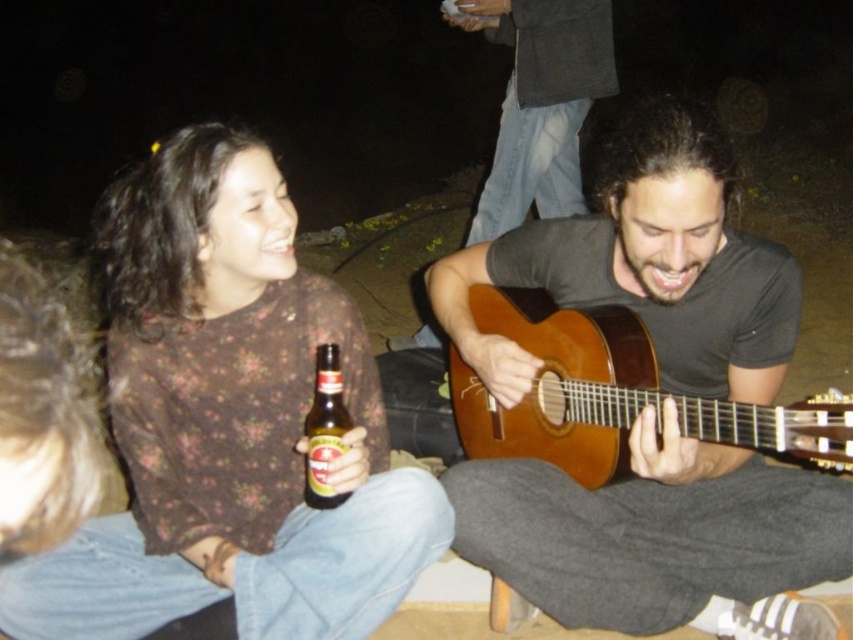
Question: Which is nearer to the dark gray sweater at upper center?

Choices:
 (A) matte brown guitar at center
 (B) brown glass bottle at lower left
 (C) wooden acoustic guitar at center
 (D) brown floral shirt at upper left

Answer: (C)

Question: Does matte brown guitar at center appear over wooden acoustic guitar at center?

Choices:
 (A) yes
 (B) no

Answer: (B)

Question: Based on their relative distances, which object is nearer to the brown glass bottle at lower left?

Choices:
 (A) dark gray sweater at upper center
 (B) matte brown guitar at center
 (C) wooden acoustic guitar at center
 (D) brown floral shirt at upper left

Answer: (D)

Question: Is the position of dark gray sweater at upper center more distant than that of brown glass bottle at lower left?

Choices:
 (A) no
 (B) yes

Answer: (B)

Question: Which point appears farthest from the camera in this image?

Choices:
 (A) (502, 125)
 (B) (329, 381)
 (C) (294, 362)

Answer: (A)

Question: Is matte brown guitar at center above dark gray sweater at upper center?

Choices:
 (A) no
 (B) yes

Answer: (A)